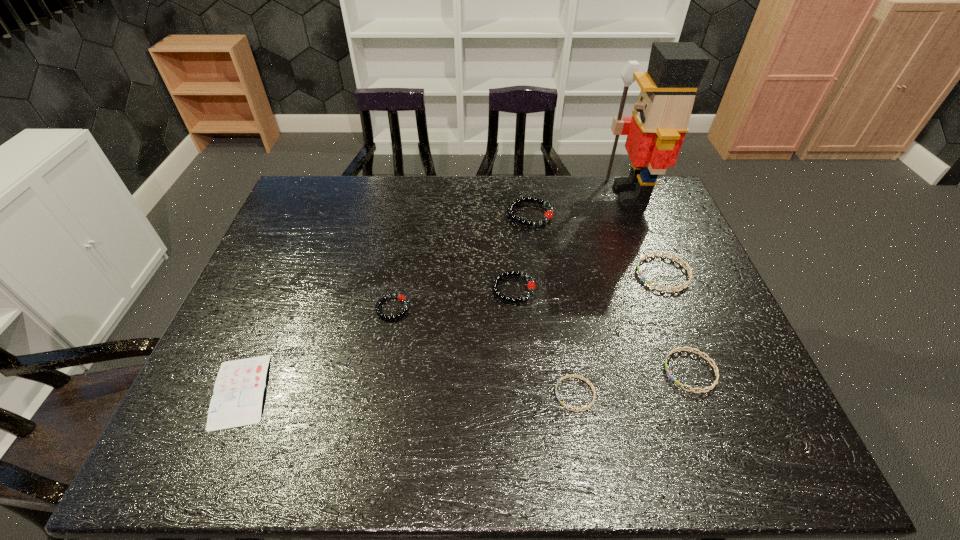
At what (x,y) coordinates should I click in order to perform the action: click on bracelet located at the far edge. Please return your answer as a coordinate pair (x, y). The height and width of the screenshot is (540, 960). Looking at the image, I should click on (548, 215).

This screenshot has width=960, height=540. I want to click on object located in the near edge section of the desktop, so click(239, 388).

Find the location of a particular element. object that is at the left edge is located at coordinates [239, 388].

This screenshot has height=540, width=960. What are the coordinates of `nutcracker located at the right edge` in the screenshot? It's located at (655, 132).

Image resolution: width=960 pixels, height=540 pixels. In order to click on object situated at the near left corner in this screenshot , I will do `click(239, 388)`.

Locate an element on the screen. This screenshot has height=540, width=960. object at the far right corner is located at coordinates (655, 132).

In the image, there is a desktop. Where is `free space at the far edge`? The image size is (960, 540). free space at the far edge is located at coordinates (524, 193).

The image size is (960, 540). Find the location of `vacant space at the near edge`. vacant space at the near edge is located at coordinates (489, 433).

Image resolution: width=960 pixels, height=540 pixels. I want to click on free space at the left edge, so click(278, 362).

Identify the location of vacant region at the right edge. This screenshot has height=540, width=960. (684, 306).